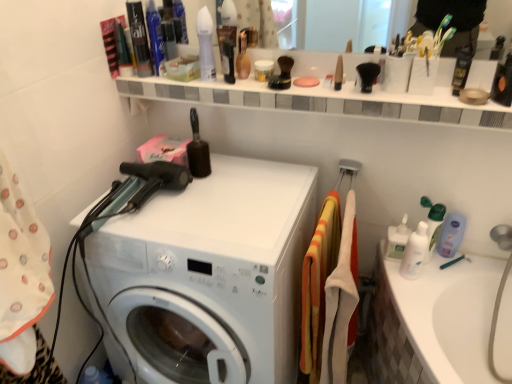
Question: Can you confirm if white matte jar at upper center, which ranks as the 4th toiletry in right-to-left order, is shorter than orange/yellow striped towel at center, the second material viewed from the right?

Choices:
 (A) no
 (B) yes

Answer: (B)

Question: Does white matte jar at upper center, the 4th toiletry positioned from the left, contain orange/yellow striped towel at center, the second material viewed from the right?

Choices:
 (A) no
 (B) yes

Answer: (A)

Question: Is white matte jar at upper center, the 4th toiletry positioned from the left, positioned with its back to orange/yellow striped towel at center, the first material in the left-to-right sequence?

Choices:
 (A) no
 (B) yes

Answer: (A)

Question: From a real-world perspective, does white matte jar at upper center, placed as the 4th toiletry when sorted from bottom to top, stand above orange/yellow striped towel at center, the second material viewed from the right?

Choices:
 (A) yes
 (B) no

Answer: (A)

Question: Is white matte jar at upper center, the 4th toiletry positioned from the left, positioned behind orange/yellow striped towel at center, the second material viewed from the right?

Choices:
 (A) yes
 (B) no

Answer: (A)

Question: Considering the positions of white glossy lotion at right, which is the sixth toiletry from left to right, and orange/yellow striped towel at center, the second material viewed from the right, in the image, is white glossy lotion at right, which is the sixth toiletry from left to right, wider or thinner than orange/yellow striped towel at center, the second material viewed from the right,?

Choices:
 (A) wide
 (B) thin

Answer: (A)

Question: From the image's perspective, is white glossy lotion at right, which ranks as the first toiletry in bottom-to-top order, located above or below orange/yellow striped towel at center, the first material in the left-to-right sequence?

Choices:
 (A) above
 (B) below

Answer: (A)

Question: Looking at the image, does white glossy lotion at right, which is the sixth toiletry from left to right, seem bigger or smaller compared to orange/yellow striped towel at center, the first material in the left-to-right sequence?

Choices:
 (A) small
 (B) big

Answer: (A)

Question: From their relative heights in the image, would you say white glossy lotion at right, which ranks as the 7th toiletry in top-to-bottom order, is taller or shorter than orange/yellow striped towel at center, the second material viewed from the right?

Choices:
 (A) tall
 (B) short

Answer: (B)

Question: Is point (152, 1) closer or farther from the camera than point (391, 241)?

Choices:
 (A) farther
 (B) closer

Answer: (B)

Question: In terms of width, does shiny blue bottle at upper left, which is the 6th toiletry in right-to-left order, look wider or thinner when compared to white plastic bottles at right, which is the 1th cleaning product in left-to-right order?

Choices:
 (A) thin
 (B) wide

Answer: (A)

Question: Choose the correct answer: Is shiny blue bottle at upper left, which is the 6th toiletry in right-to-left order, inside white plastic bottles at right, positioned as the second cleaning product in right-to-left order, or outside it?

Choices:
 (A) outside
 (B) inside

Answer: (A)

Question: Considering the positions of shiny blue bottle at upper left, acting as the 7th toiletry starting from the bottom, and white plastic bottles at right, which is the 1th cleaning product in left-to-right order, in the image, is shiny blue bottle at upper left, acting as the 7th toiletry starting from the bottom, taller or shorter than white plastic bottles at right, which is the 1th cleaning product in left-to-right order,?

Choices:
 (A) short
 (B) tall

Answer: (B)

Question: From a real-world perspective, relative to black matte hair gel at upper right, positioned as the 1th toiletry in right-to-left order, is white matte jar at upper center, which ranks as the 4th toiletry in right-to-left order, vertically above or below?

Choices:
 (A) above
 (B) below

Answer: (B)

Question: Based on their sizes in the image, would you say white matte jar at upper center, placed as the 4th toiletry when sorted from bottom to top, is bigger or smaller than black matte hair gel at upper right, the seventh toiletry positioned from the left?

Choices:
 (A) big
 (B) small

Answer: (A)